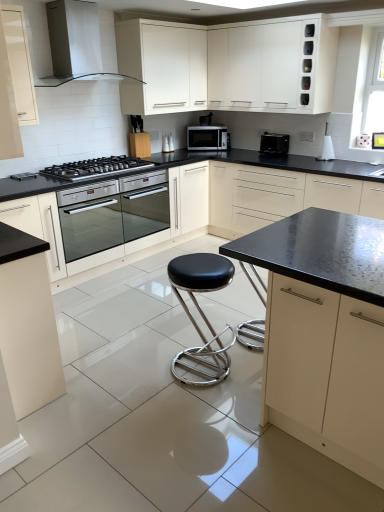
Question: Can you confirm if black leather stool at center is shorter than satin silver microwave at center, marked as the second kitchen appliance in a front-to-back arrangement?

Choices:
 (A) no
 (B) yes

Answer: (A)

Question: Is black leather stool at center thinner than satin silver microwave at center, which is counted as the 1th kitchen appliance, starting from the left?

Choices:
 (A) yes
 (B) no

Answer: (B)

Question: Does black leather stool at center appear on the right side of satin silver microwave at center, the 1th kitchen appliance viewed from the back?

Choices:
 (A) no
 (B) yes

Answer: (A)

Question: Is satin silver microwave at center, the 1th kitchen appliance viewed from the back, at the back of black leather stool at center?

Choices:
 (A) yes
 (B) no

Answer: (B)

Question: Does black leather stool at center touch satin silver microwave at center, marked as the second kitchen appliance in a front-to-back arrangement?

Choices:
 (A) yes
 (B) no

Answer: (B)

Question: Relative to matte black countertop at center, arranged as the sixth cabinetry when viewed from the left, is black stainless steel gas stove at left in front or behind?

Choices:
 (A) front
 (B) behind

Answer: (B)

Question: Considering the positions of black stainless steel gas stove at left and matte black countertop at center, the 1th cabinetry in the right-to-left sequence, in the image, is black stainless steel gas stove at left bigger or smaller than matte black countertop at center, the 1th cabinetry in the right-to-left sequence,?

Choices:
 (A) small
 (B) big

Answer: (A)

Question: Visually, is black stainless steel gas stove at left positioned to the left or to the right of matte black countertop at center, arranged as the sixth cabinetry when viewed from the left?

Choices:
 (A) right
 (B) left

Answer: (B)

Question: From a real-world perspective, is black stainless steel gas stove at left positioned above or below matte black countertop at center, arranged as the sixth cabinetry when viewed from the left?

Choices:
 (A) below
 (B) above

Answer: (B)

Question: Based on their sizes in the image, would you say stainless steel oven at center is bigger or smaller than black stainless steel gas stove at left?

Choices:
 (A) big
 (B) small

Answer: (A)

Question: Based on their positions, is stainless steel oven at center located to the left or right of black stainless steel gas stove at left?

Choices:
 (A) right
 (B) left

Answer: (A)

Question: Considering the positions of point (89, 215) and point (92, 164), is point (89, 215) closer or farther from the camera than point (92, 164)?

Choices:
 (A) closer
 (B) farther

Answer: (A)

Question: Is stainless steel oven at center wider or thinner than black stainless steel gas stove at left?

Choices:
 (A) wide
 (B) thin

Answer: (A)

Question: In the image, is matte white cabinet at lower left, which is the fifth cabinetry from right to left, positioned in front of or behind white glossy range hood at upper left?

Choices:
 (A) behind
 (B) front

Answer: (B)

Question: From a real-world perspective, is matte white cabinet at lower left, which is the fifth cabinetry from right to left, positioned above or below white glossy range hood at upper left?

Choices:
 (A) below
 (B) above

Answer: (A)